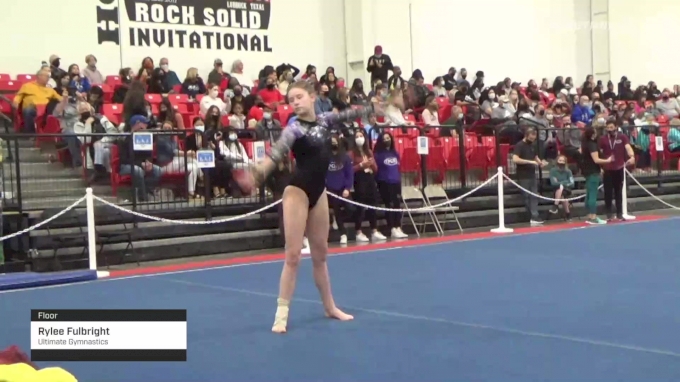
I want to click on folding chairs, so point(436,191), point(408,196).